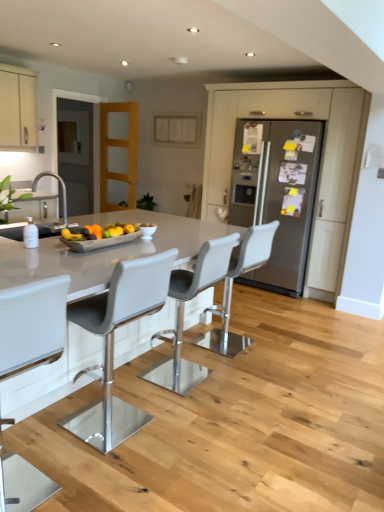
At what (x,y) coordinates should I click in order to perform the action: click on white leather bar stool at center, the first chair viewed from the back. Please return your answer as a coordinate pair (x, y). The image size is (384, 512). Looking at the image, I should click on (232, 286).

At what (x,y) coordinates should I click in order to perform the action: click on matte cream cabinet at upper left, positioned as the 1th cabinetry in left-to-right order. Please return your answer as a coordinate pair (x, y). Looking at the image, I should click on (18, 108).

Measure the distance between point (17, 131) and camera.

They are 4.45 meters apart.

What do you see at coordinates (59, 183) in the screenshot? I see `polished stainless steel faucet at upper left` at bounding box center [59, 183].

Image resolution: width=384 pixels, height=512 pixels. Identify the location of transparent glass door at left. (76, 154).

Is point (110, 243) positioned before point (62, 188)?

Yes, point (110, 243) is closer to viewer.

Find the location of a particular element. This screenshot has width=384, height=512. silver on the left side of matte gray tray at center is located at coordinates (59, 183).

Is matte gray tray at center in front of polished stainless steel faucet at upper left?

Yes, matte gray tray at center is in front of polished stainless steel faucet at upper left.

Visually, is matte gray tray at center positioned to the left or to the right of polished stainless steel faucet at upper left?

Clearly, matte gray tray at center is on the right of polished stainless steel faucet at upper left in the image.

Is satin silver fridge at center wider than white leather bar stool at center, the first chair viewed from the back?

Yes.

From the picture: Does satin silver fridge at center appear on the left side of white leather bar stool at center, arranged as the 4th chair when viewed from the front?

No.

Who is taller, satin silver fridge at center or white leather bar stool at center, the first chair viewed from the back?

Standing taller between the two is satin silver fridge at center.

From a real-world perspective, is satin silver fridge at center below white leather bar stool at center, arranged as the 4th chair when viewed from the front?

Actually, satin silver fridge at center is physically above white leather bar stool at center, arranged as the 4th chair when viewed from the front, in the real world.

From the picture: Looking at the image, does matte cream cabinet at upper left, the 3th cabinetry in the right-to-left sequence, seem bigger or smaller compared to white leather bar stool at center, the first chair viewed from the back?

matte cream cabinet at upper left, the 3th cabinetry in the right-to-left sequence, is smaller than white leather bar stool at center, the first chair viewed from the back.

From a real-world perspective, which chair is the 3rd one underneath the matte cream cabinet at upper left, positioned as the 1th cabinetry in left-to-right order? Please provide its 2D coordinates.

[(232, 286)]

Considering the sizes of objects matte cream cabinet at upper left, the 3th cabinetry in the right-to-left sequence, and white leather bar stool at center, the first chair viewed from the back, in the image provided, who is taller, matte cream cabinet at upper left, the 3th cabinetry in the right-to-left sequence, or white leather bar stool at center, the first chair viewed from the back,?

white leather bar stool at center, the first chair viewed from the back, is taller.

From the image's perspective, is white leather bar stool at center, the first chair viewed from the back, above white leather bar stool at center, acting as the 1th chair starting from the front?

Correct, white leather bar stool at center, the first chair viewed from the back, appears higher than white leather bar stool at center, acting as the 1th chair starting from the front, in the image.

Can you confirm if white leather bar stool at center, the first chair viewed from the back, is wider than white leather bar stool at center, positioned as the fourth chair in back-to-front order?

No, white leather bar stool at center, the first chair viewed from the back, is not wider than white leather bar stool at center, positioned as the fourth chair in back-to-front order.

Is white leather bar stool at center, arranged as the 4th chair when viewed from the front, taller than white leather bar stool at center, acting as the 1th chair starting from the front?

No.

Based on the photo, which object is further away from the camera, white leather bar stool at center, the first chair viewed from the back, or white leather bar stool at center, positioned as the fourth chair in back-to-front order?

white leather bar stool at center, the first chair viewed from the back, is behind.

From the matte white cabinet at upper center, which is counted as the second cabinetry, starting from the right, count 1st chairs forward and point to it. Please provide its 2D coordinates.

[(232, 286)]

Visually, is matte white cabinet at upper center, the second cabinetry positioned from the left, positioned to the left or to the right of white leather bar stool at center, arranged as the 4th chair when viewed from the front?

Based on their positions, matte white cabinet at upper center, the second cabinetry positioned from the left, is located to the left of white leather bar stool at center, arranged as the 4th chair when viewed from the front.

From a real-world perspective, does matte white cabinet at upper center, which is counted as the second cabinetry, starting from the right, sit lower than white leather bar stool at center, the first chair viewed from the back?

→ No.

Does matte white cabinet at upper center, the second cabinetry positioned from the left, lie behind white leather bar stool at center, arranged as the 4th chair when viewed from the front?

Yes.

From a real-world perspective, between white leather bar stool at center, arranged as the 4th chair when viewed from the front, and matte gray refrigerator at center, the first cabinetry in the right-to-left sequence, who is vertically lower?

white leather bar stool at center, arranged as the 4th chair when viewed from the front.

Is white leather bar stool at center, arranged as the 4th chair when viewed from the front, next to matte gray refrigerator at center, placed as the third cabinetry when sorted from left to right?

No, white leather bar stool at center, arranged as the 4th chair when viewed from the front, is not beside matte gray refrigerator at center, placed as the third cabinetry when sorted from left to right.

Between white leather bar stool at center, the first chair viewed from the back, and matte gray refrigerator at center, placed as the third cabinetry when sorted from left to right, which one has more height?

matte gray refrigerator at center, placed as the third cabinetry when sorted from left to right, is taller.

Does matte white cabinet at upper center, the second cabinetry positioned from the left, turn towards white leather bar stool at center, the second chair in the back-to-front sequence?

No, matte white cabinet at upper center, the second cabinetry positioned from the left, is not turned towards white leather bar stool at center, the second chair in the back-to-front sequence.

The width and height of the screenshot is (384, 512). In order to click on the 1st chair counting from the right of the matte white cabinet at upper center, which is counted as the second cabinetry, starting from the right in this screenshot , I will do `click(183, 313)`.

In terms of height, does matte white cabinet at upper center, the second cabinetry positioned from the left, look taller or shorter compared to white leather bar stool at center, the second chair in the back-to-front sequence?

Considering their sizes, matte white cabinet at upper center, the second cabinetry positioned from the left, has less height than white leather bar stool at center, the second chair in the back-to-front sequence.

Relative to white leather bar stool at center, acting as the 3th chair starting from the front, is matte white cabinet at upper center, the second cabinetry positioned from the left, in front or behind?

Visually, matte white cabinet at upper center, the second cabinetry positioned from the left, is located behind white leather bar stool at center, acting as the 3th chair starting from the front.

Find the location of `silver that appears above the matte gray tray at center (from the image's perspective)`. silver that appears above the matte gray tray at center (from the image's perspective) is located at coordinates (59, 183).

Image resolution: width=384 pixels, height=512 pixels. Identify the location of refrigerator that is on the right side of white leather bar stool at center, the first chair viewed from the back. (280, 196).

When comparing their distances from matte white cabinet at upper center, which is counted as the second cabinetry, starting from the right, does transparent glass door at left or matte gray refrigerator at center, placed as the third cabinetry when sorted from left to right, seem closer?

transparent glass door at left is positioned closer to the anchor matte white cabinet at upper center, which is counted as the second cabinetry, starting from the right.

In the scene shown: Based on their spatial positions, is polished stainless steel faucet at upper left or matte gray refrigerator at center, placed as the third cabinetry when sorted from left to right, closer to transparent glass door at left?

polished stainless steel faucet at upper left is closer to transparent glass door at left.

Estimate the real-world distances between objects in this image. Which object is further from white leather bar stool at center, acting as the 3th chair starting from the front, transparent glass door at left or white leather bar stool at center, acting as the 1th chair starting from the front?

Based on the image, transparent glass door at left appears to be further to white leather bar stool at center, acting as the 3th chair starting from the front.

Based on the photo, based on their spatial positions, is satin silver fridge at center or white leather bar stool at center, acting as the 3th chair starting from the front, further from white leather bar stool at center, placed as the third chair when sorted from back to front?

satin silver fridge at center is further to white leather bar stool at center, placed as the third chair when sorted from back to front.

Based on their spatial positions, is matte white cabinet at upper center, the second cabinetry positioned from the left, or white leather bar stool at center, placed as the third chair when sorted from back to front, closer to matte cream cabinet at upper left, positioned as the 1th cabinetry in left-to-right order?

matte white cabinet at upper center, the second cabinetry positioned from the left.

Which object lies nearer to the anchor point matte cream cabinet at upper left, positioned as the 1th cabinetry in left-to-right order, matte gray tray at center or polished stainless steel faucet at upper left?

polished stainless steel faucet at upper left is closer to matte cream cabinet at upper left, positioned as the 1th cabinetry in left-to-right order.

Based on their spatial positions, is satin silver fridge at center or transparent glass door at left closer to white leather bar stool at center, acting as the 3th chair starting from the front?

satin silver fridge at center is positioned closer to the anchor white leather bar stool at center, acting as the 3th chair starting from the front.

Looking at the image, which one is located further to matte cream cabinet at upper left, positioned as the 1th cabinetry in left-to-right order, transparent glass door at left or white leather bar stool at center, the first chair viewed from the back?

white leather bar stool at center, the first chair viewed from the back, is positioned further to the anchor matte cream cabinet at upper left, positioned as the 1th cabinetry in left-to-right order.

Where is `silver between matte cream cabinet at upper left, the 3th cabinetry in the right-to-left sequence, and matte gray refrigerator at center, placed as the third cabinetry when sorted from left to right`? This screenshot has width=384, height=512. silver between matte cream cabinet at upper left, the 3th cabinetry in the right-to-left sequence, and matte gray refrigerator at center, placed as the third cabinetry when sorted from left to right is located at coordinates (59, 183).

Identify the location of fruit dish situated between matte cream cabinet at upper left, the 3th cabinetry in the right-to-left sequence, and white leather bar stool at center, the first chair viewed from the back, from left to right. This screenshot has height=512, width=384. (101, 242).

Where is `fruit dish located between white leather bar stool at center, acting as the 1th chair starting from the front, and polished stainless steel faucet at upper left in the depth direction`? The image size is (384, 512). fruit dish located between white leather bar stool at center, acting as the 1th chair starting from the front, and polished stainless steel faucet at upper left in the depth direction is located at coordinates (101, 242).

What are the coordinates of `chair between white leather bar stool at center, acting as the 3th chair starting from the front, and satin silver fridge at center, along the z-axis` in the screenshot? It's located at (232, 286).